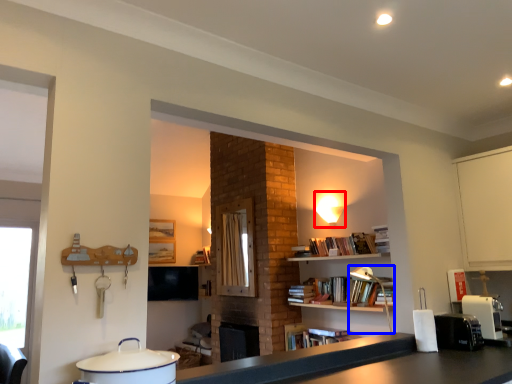
Question: Which of the following is the closest to the observer, light fixture (highlighted by a red box) or lamp (highlighted by a blue box)?

Choices:
 (A) light fixture
 (B) lamp

Answer: (B)